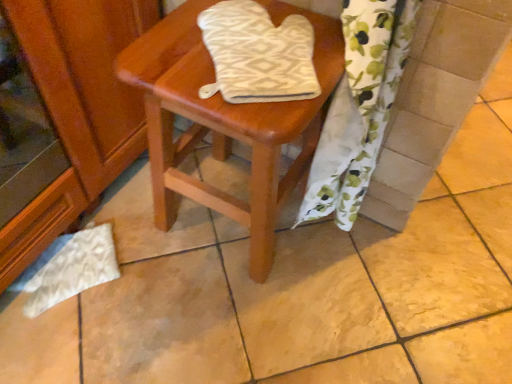
Identify the location of blank space situated above wooden stool at center (from a real-world perspective). (218, 70).